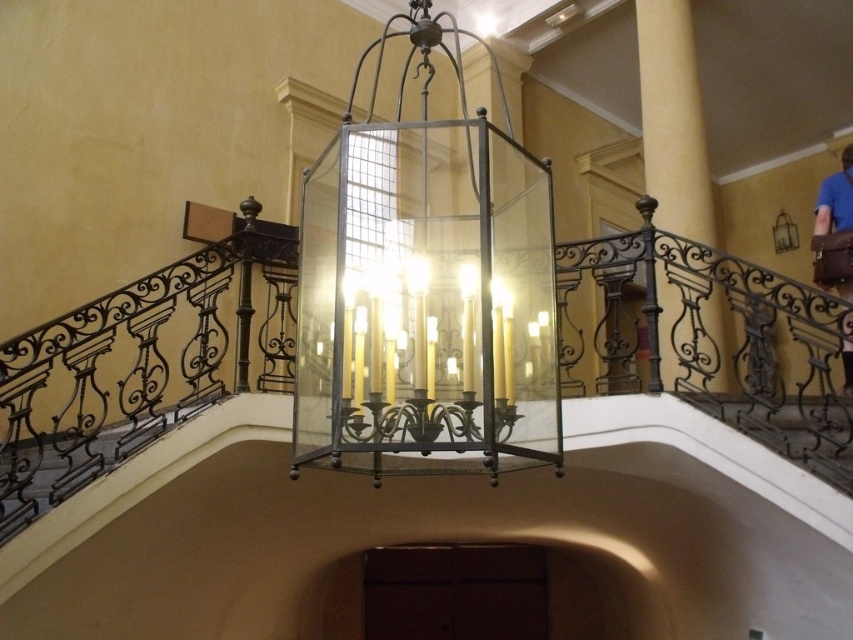
You are standing in the center of the room looking towards the chandelier. Which direction should you move to reach the wrought iron railing at left?

The wrought iron railing at left is located at point (85,454), which is to the left side of the room. Therefore, you should move to your left to reach it.

You are standing in the center of the room looking up. Which object is closer to the top edge of your field of view, the yellow matte column at upper right or the chandelier?

The yellow matte column at upper right is closer to the top edge of your field of view because its 2D location is at point (672, 120), which is higher up compared to the chandelier.

You are an interior designer planning to install a new 1.80 meter wide decorative panel between the yellow matte column at upper right and the metallic wrought iron at lower right. Based on the available space, will the panel fit without overlapping either object?

The distance between the yellow matte column at upper right and the metallic wrought iron at lower right is 2.00 meters. Since the panel is 1.80 meters wide, it will fit within the space as 1.80 meters is less than 2.00 meters.